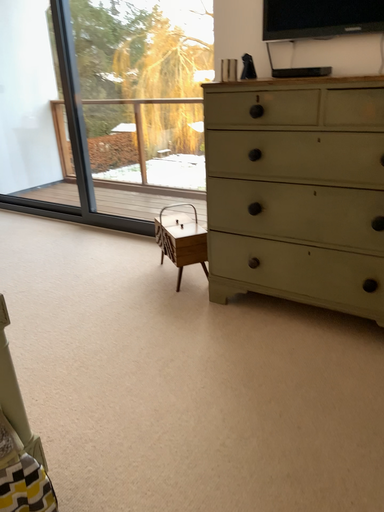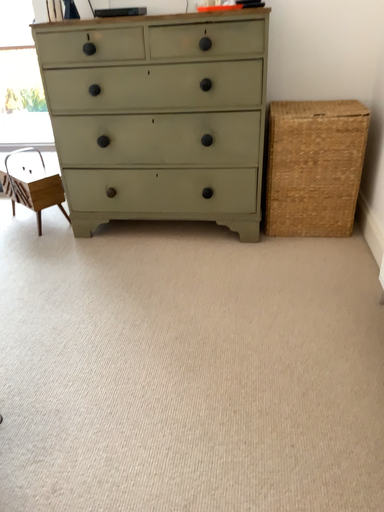
Question: How did the camera likely rotate when shooting the video?

Choices:
 (A) rotated left
 (B) rotated right

Answer: (B)